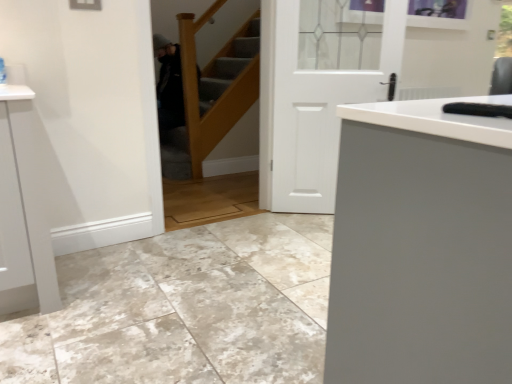
What is the approximate width of white wooden door at center?

white wooden door at center is 6.12 inches in width.

The height and width of the screenshot is (384, 512). What do you see at coordinates (310, 108) in the screenshot?
I see `white wooden door at center` at bounding box center [310, 108].

In order to face white wooden door at center, should I rotate leftwards or rightwards?

It's best to rotate right around 10.524 degrees.

This screenshot has height=384, width=512. What are the coordinates of `white wooden door at center` in the screenshot? It's located at (310, 108).

What do you see at coordinates (211, 95) in the screenshot? Image resolution: width=512 pixels, height=384 pixels. I see `wooden stairwell at center` at bounding box center [211, 95].

Locate an element on the screen. The width and height of the screenshot is (512, 384). wooden stairwell at center is located at coordinates (211, 95).

What are the coordinates of `white wooden door at center` in the screenshot? It's located at pyautogui.click(x=310, y=108).

Is white wooden door at center to the right of wooden stairwell at center from the viewer's perspective?

Correct, you'll find white wooden door at center to the right of wooden stairwell at center.

Is white wooden door at center closer to the viewer compared to wooden stairwell at center?

No, the depth of white wooden door at center is greater than that of wooden stairwell at center.

Which is closer, [391,19] or [233,101]?

Clearly, point [391,19] is closer to the camera than point [233,101].

From the image's perspective, is white wooden door at center above or below wooden stairwell at center?

white wooden door at center is situated lower than wooden stairwell at center in the image.

Consider the image. From a real-world perspective, is white wooden door at center above or below wooden stairwell at center?

In terms of real-world spatial position, white wooden door at center is below wooden stairwell at center.

Which object is thinner, white wooden door at center or wooden stairwell at center?

white wooden door at center.

Can you confirm if white wooden door at center is taller than wooden stairwell at center?

No.

Which of these two, white wooden door at center or wooden stairwell at center, is smaller?

With smaller size is white wooden door at center.

Is white wooden door at center outside of wooden stairwell at center?

white wooden door at center lies outside wooden stairwell at center's area.

Is white wooden door at center touching wooden stairwell at center?

No, white wooden door at center is not touching wooden stairwell at center.

Is white wooden door at center oriented towards wooden stairwell at center?

No, white wooden door at center is not facing towards wooden stairwell at center.

How many degrees apart are the facing directions of white wooden door at center and wooden stairwell at center?

white wooden door at center and wooden stairwell at center are facing 33.8 degrees away from each other.

How far apart are white wooden door at center and wooden stairwell at center?

The distance of white wooden door at center from wooden stairwell at center is 1.11 meters.

Where is `door behind the wooden stairwell at center`? door behind the wooden stairwell at center is located at coordinates (310, 108).

Between wooden stairwell at center and white wooden door at center, which one appears on the right side from the viewer's perspective?

Positioned to the right is white wooden door at center.

Is wooden stairwell at center behind white wooden door at center?

No, wooden stairwell at center is closer to the viewer.

Is point (194, 145) in front of point (264, 19)?

No, (194, 145) is further to viewer.

From the image's perspective, which one is positioned higher, wooden stairwell at center or white wooden door at center?

From the image's view, wooden stairwell at center is above.

Looking at this image, from a real-world perspective, is wooden stairwell at center positioned above or below white wooden door at center?

Clearly, from a real-world perspective, wooden stairwell at center is above white wooden door at center.

Is wooden stairwell at center thinner than white wooden door at center?

No, wooden stairwell at center is not thinner than white wooden door at center.

In terms of height, does wooden stairwell at center look taller or shorter compared to white wooden door at center?

In the image, wooden stairwell at center appears to be taller than white wooden door at center.

Considering the sizes of wooden stairwell at center and white wooden door at center in the image, is wooden stairwell at center bigger or smaller than white wooden door at center?

Considering their sizes, wooden stairwell at center takes up more space than white wooden door at center.

Is wooden stairwell at center inside the boundaries of white wooden door at center, or outside?

wooden stairwell at center is not inside white wooden door at center, it's outside.

Is wooden stairwell at center not close to white wooden door at center?

wooden stairwell at center is positioned a significant distance from white wooden door at center.

Is white wooden door at center at the back of wooden stairwell at center?

No, white wooden door at center is not at the back of wooden stairwell at center.

Can you tell me how much wooden stairwell at center and white wooden door at center differ in facing direction?

33.8 degrees.

Find the location of a particular element. This screenshot has width=512, height=384. stairwell that is on the left side of white wooden door at center is located at coordinates (211, 95).

Identify the location of door that is under the wooden stairwell at center (from a real-world perspective). (310, 108).

Find the location of a particular element. stairwell in front of the white wooden door at center is located at coordinates [x=211, y=95].